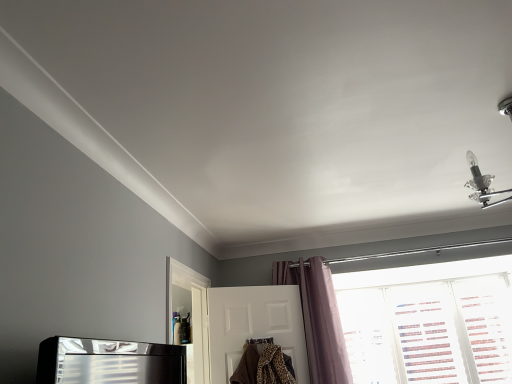
Question: Based on their positions, is transparent plastic screen door at lower left located to the left or right of purple velvet curtain at center?

Choices:
 (A) left
 (B) right

Answer: (A)

Question: Is point (182, 337) positioned closer to the camera than point (309, 367)?

Choices:
 (A) farther
 (B) closer

Answer: (A)

Question: Which is farther from the purple velvet curtain at center?

Choices:
 (A) transparent plastic screen door at lower left
 (B) white textured blinds at lower right
 (C) white matte door at center

Answer: (B)

Question: Which object is positioned farthest from the white matte door at center?

Choices:
 (A) transparent plastic screen door at lower left
 (B) purple velvet curtain at center
 (C) white textured blinds at lower right

Answer: (C)